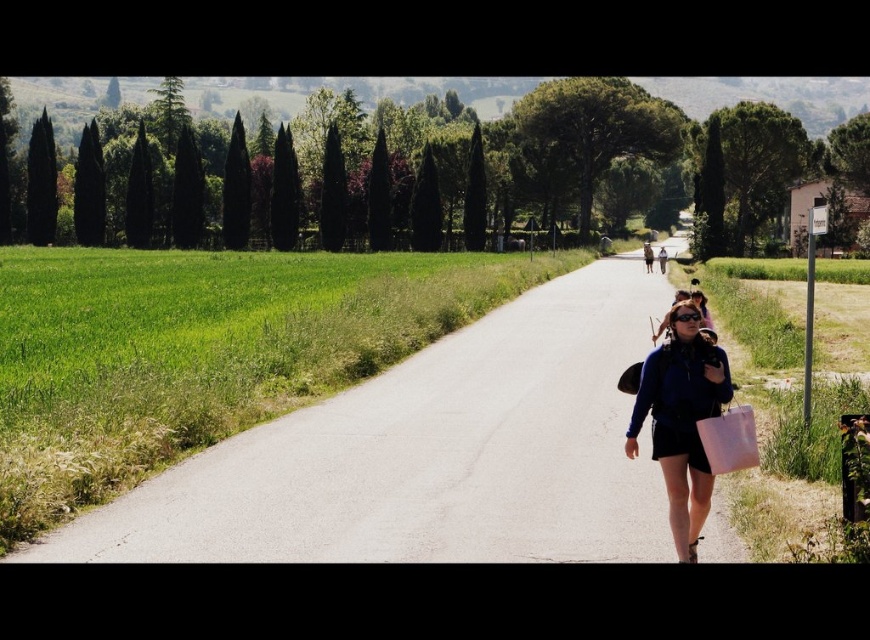
Between matte blue jacket at center and white fabric bag at lower right, which one has less height?

white fabric bag at lower right is shorter.

Where is `matte blue jacket at center`? The height and width of the screenshot is (640, 870). matte blue jacket at center is located at coordinates (680, 419).

In order to click on matte blue jacket at center in this screenshot , I will do `click(680, 419)`.

Does smooth asphalt road at center have a larger size compared to matte blue jacket at center?

Indeed, smooth asphalt road at center has a larger size compared to matte blue jacket at center.

Does point (212, 516) lie in front of point (690, 392)?

No.

The image size is (870, 640). I want to click on smooth asphalt road at center, so click(427, 454).

Between point (395, 490) and point (697, 424), which one is positioned behind?

Point (395, 490)

Does smooth asphalt road at center come behind white fabric bag at lower right?

Yes, smooth asphalt road at center is further from the viewer.

Is point (406, 529) more distant than point (745, 406)?

Yes, it is.

Image resolution: width=870 pixels, height=640 pixels. What are the coordinates of `smooth asphalt road at center` in the screenshot? It's located at (427, 454).